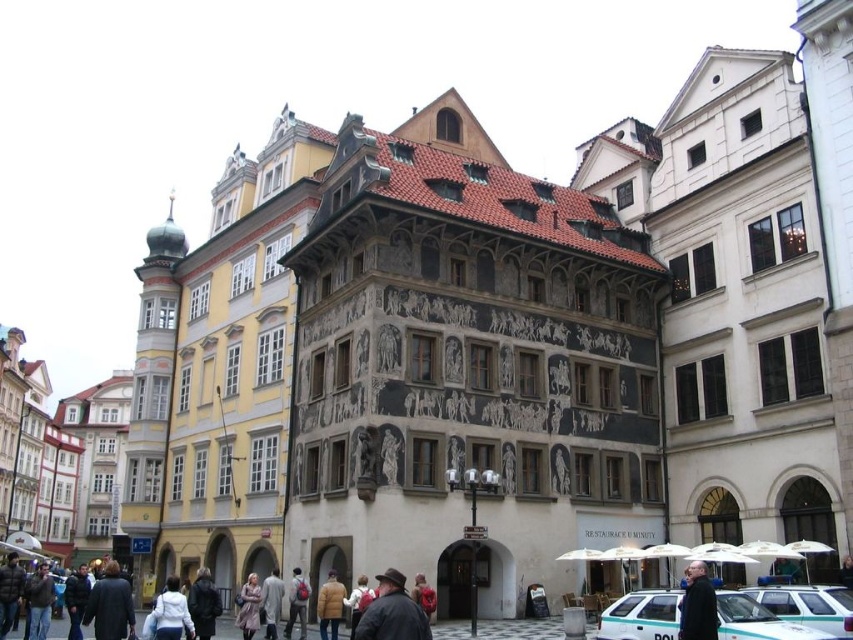
Question: Considering the real-world distances, which object is farthest from the teal glossy police car at lower right?

Choices:
 (A) white glossy car at lower right
 (B) dark gray coat at center
 (C) dark brown leather jacket at center

Answer: (C)

Question: Based on their relative distances, which object is nearer to the white glossy car at lower right?

Choices:
 (A) light brown down jacket at lower center
 (B) dark gray coat at center
 (C) teal glossy police car at lower right

Answer: (C)

Question: Which of the following is the farthest from the observer?

Choices:
 (A) (820, 618)
 (B) (341, 600)
 (C) (648, 628)

Answer: (B)

Question: Can you confirm if teal glossy police car at lower right is wider than white glossy car at lower right?

Choices:
 (A) no
 (B) yes

Answer: (B)

Question: Does teal glossy police car at lower right appear on the right side of white glossy car at lower right?

Choices:
 (A) yes
 (B) no

Answer: (B)

Question: Considering the relative positions of teal glossy police car at lower right and dark gray coat at center in the image provided, where is teal glossy police car at lower right located with respect to dark gray coat at center?

Choices:
 (A) above
 (B) below

Answer: (B)